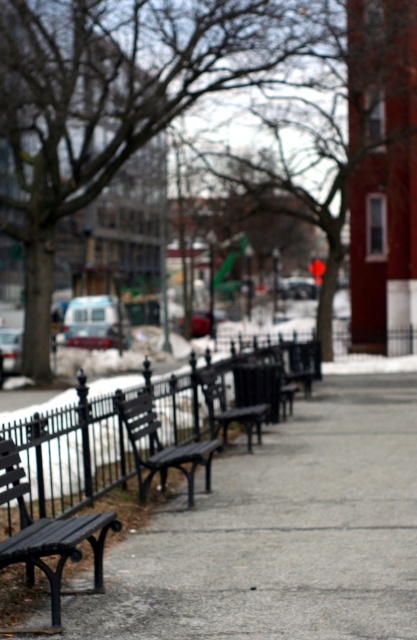
Does matte black bench at lower left appear over matte black bench at center?

No, matte black bench at lower left is not above matte black bench at center.

Which is above, matte black bench at lower left or matte black bench at center?

matte black bench at center is higher up.

Between point (100, 531) and point (235, 419), which one is positioned behind?

Positioned behind is point (235, 419).

Find the location of `matte black bench at lower left`. matte black bench at lower left is located at coordinates (49, 532).

Does matte black bench at lower left have a lesser height compared to black wood bench at center?

In fact, matte black bench at lower left may be taller than black wood bench at center.

Is matte black bench at lower left above black wood bench at center?

No, matte black bench at lower left is not above black wood bench at center.

I want to click on matte black bench at lower left, so click(49, 532).

Can you confirm if smooth concrete sidewalk at center is positioned to the right of matte black bench at center?

Yes, smooth concrete sidewalk at center is to the right of matte black bench at center.

Does point (376, 525) come farther from viewer compared to point (211, 419)?

No, (376, 525) is in front of (211, 419).

Is point (346, 392) farther from camera compared to point (203, 371)?

Yes, point (346, 392) is farther from viewer.

At what (x,y) coordinates should I click in order to perform the action: click on smooth concrete sidewalk at center. Please return your answer as a coordinate pair (x, y). Looking at the image, I should click on (281, 532).